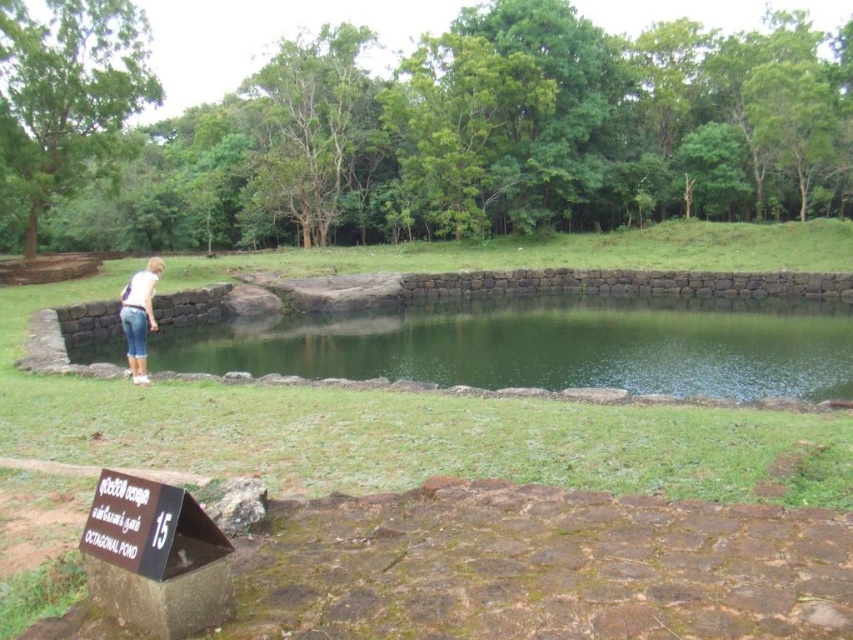
Question: Does green smooth water at center appear over denim shorts at lower left?

Choices:
 (A) no
 (B) yes

Answer: (A)

Question: Which of the following is the closest to the observer?

Choices:
 (A) tap(144, 378)
 (B) tap(637, 307)

Answer: (A)

Question: Which of the following is the farthest from the observer?

Choices:
 (A) green smooth water at center
 (B) denim shorts at lower left

Answer: (A)

Question: In this image, where is green smooth water at center located relative to denim shorts at lower left?

Choices:
 (A) left
 (B) right

Answer: (B)

Question: Can you confirm if green smooth water at center is positioned to the left of denim shorts at lower left?

Choices:
 (A) no
 (B) yes

Answer: (A)